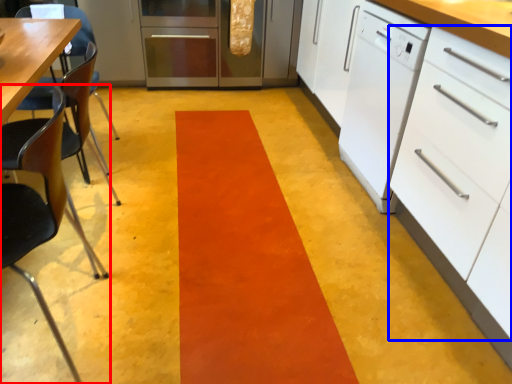
Question: Which of the following is the closest to the observer, chair (highlighted by a red box) or drawer (highlighted by a blue box)?

Choices:
 (A) chair
 (B) drawer

Answer: (A)